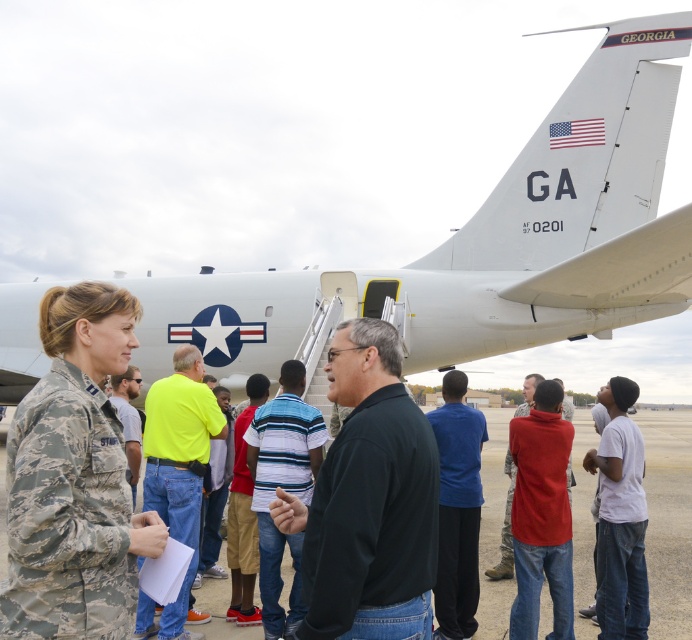
Question: Which point is closer to the camera?

Choices:
 (A) (464, 424)
 (B) (291, 387)
 (C) (185, 465)
 (D) (116, 634)

Answer: (D)

Question: Does camouflage uniform at left appear on the left side of neon yellow shirt at center?

Choices:
 (A) no
 (B) yes

Answer: (A)

Question: Among these objects, which one is farthest from the camera?

Choices:
 (A) camouflage uniform at left
 (B) blue matte shirt at center

Answer: (B)

Question: Is black matte shirt at center below blue matte shirt at center?

Choices:
 (A) no
 (B) yes

Answer: (A)

Question: Which point is farther to the camera?

Choices:
 (A) (536, 410)
 (B) (48, 500)
 (C) (127, 403)

Answer: (C)

Question: Is red matte shirt at center to the right of neon yellow shirt at center from the viewer's perspective?

Choices:
 (A) no
 (B) yes

Answer: (B)